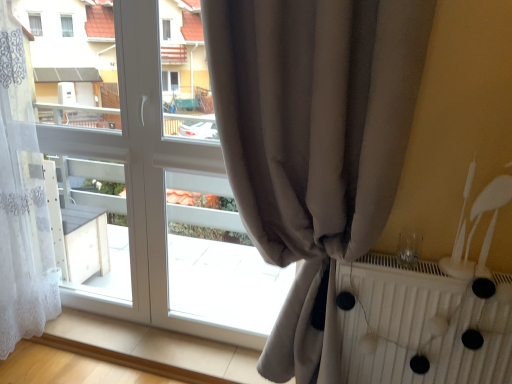
Identify the location of blank space situated above white textured radiator at right (from a real-world perspective). The width and height of the screenshot is (512, 384). (463, 271).